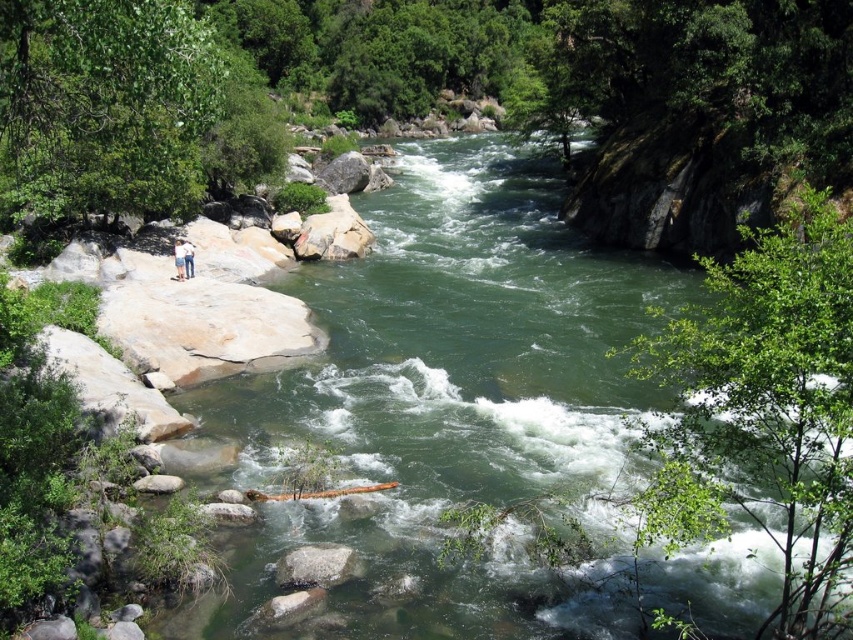
Question: Is gray smooth rock at center thinner than blue jeans at lower left?

Choices:
 (A) no
 (B) yes

Answer: (A)

Question: Which point is closer to the camera?

Choices:
 (A) light brown leather jacket at upper left
 (B) blue jeans at lower left

Answer: (A)

Question: Estimate the real-world distances between objects in this image. Which object is farther from the light brown leather jacket at upper left?

Choices:
 (A) green smooth water at center
 (B) blue jeans at lower left
 (C) gray smooth rock at center

Answer: (C)

Question: Is green smooth water at center closer to the viewer compared to blue jeans at lower left?

Choices:
 (A) yes
 (B) no

Answer: (A)

Question: Which of the following is the farthest from the observer?

Choices:
 (A) (190, 269)
 (B) (180, 260)
 (C) (602, 600)

Answer: (B)

Question: Does gray smooth rock at center have a greater width compared to blue jeans at lower left?

Choices:
 (A) no
 (B) yes

Answer: (B)